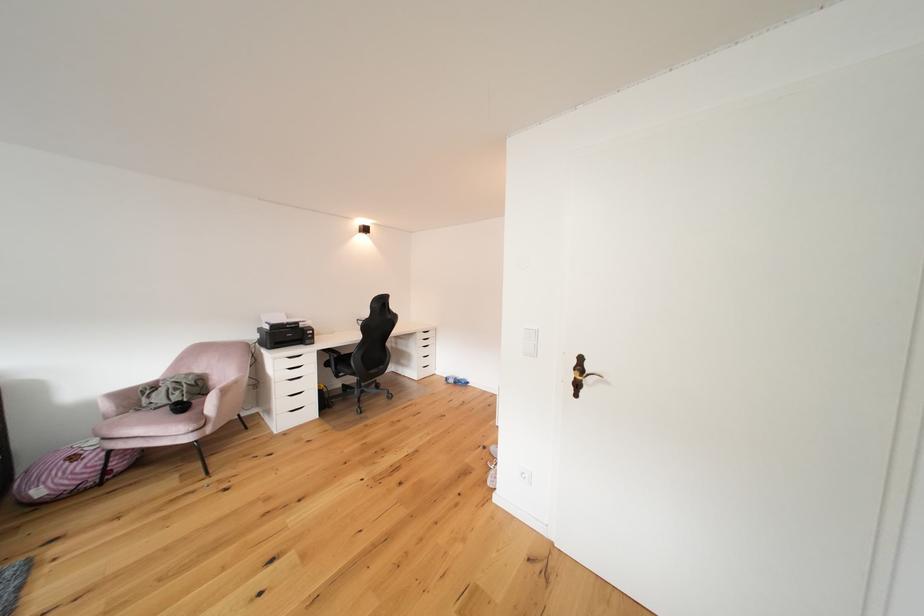
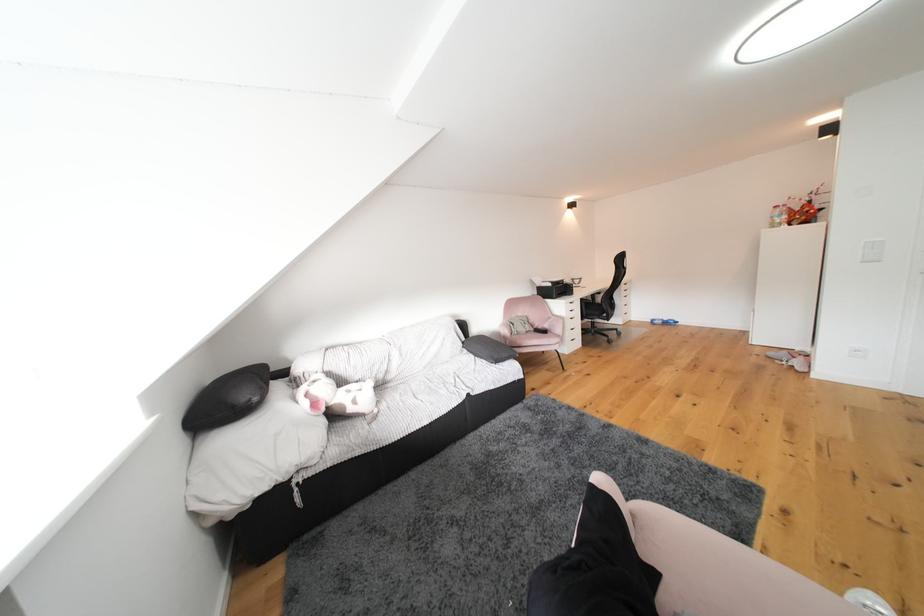
The images are taken continuously from a first-person perspective. In which direction are you moving?

The cameraman moved toward left, backward.